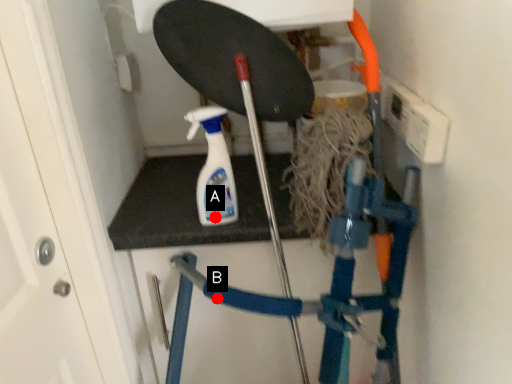
Question: Two points are circled on the image, labeled by A and B beside each circle. Which of the following is the farthest from the observer?

Choices:
 (A) A is further
 (B) B is further

Answer: (A)